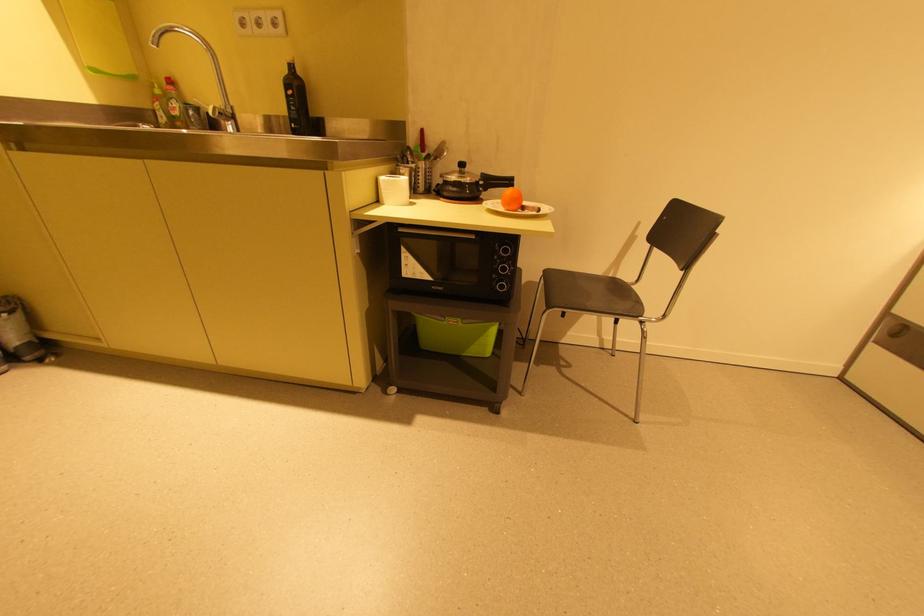
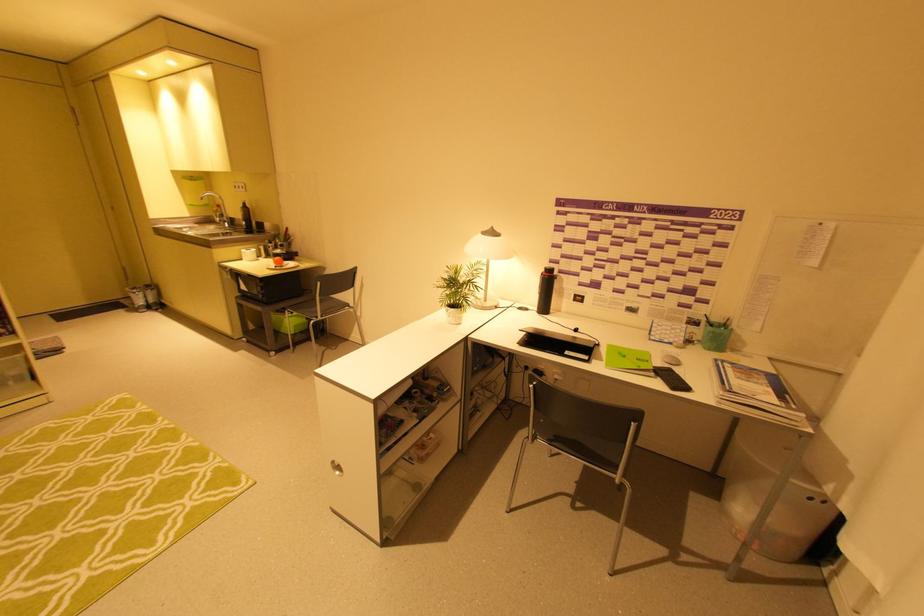
Where in the second image is the point corresponding to point 289,71 from the first image?

(246, 206)